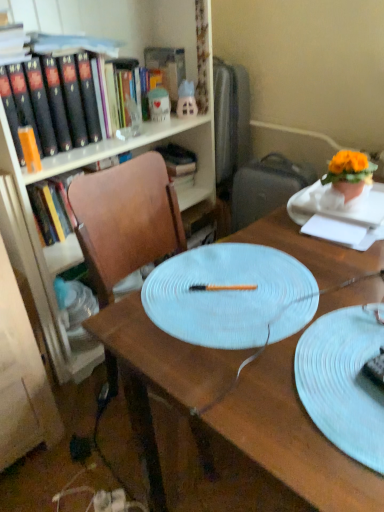
Identify the location of unoccupied space behind chocolate cake at center. The width and height of the screenshot is (384, 512). (337, 328).